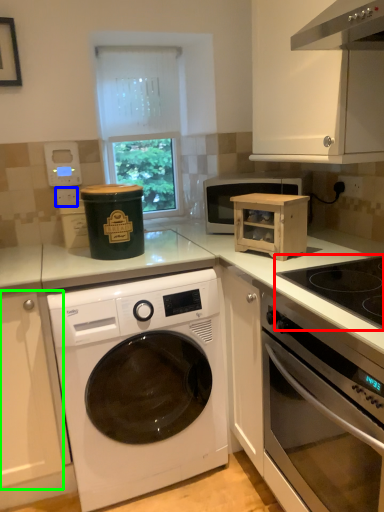
Question: Which object is positioned closest to gas stove (highlighted by a red box)? Select from electric outlet (highlighted by a blue box) and cabinetry (highlighted by a green box).

Choices:
 (A) electric outlet
 (B) cabinetry

Answer: (B)